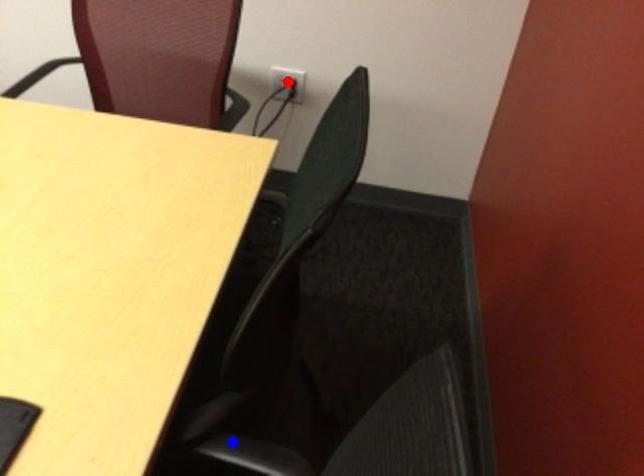
Question: Two points are marked on the image. Which point is closer to the camera?

Choices:
 (A) Blue point is closer.
 (B) Red point is closer.

Answer: (A)